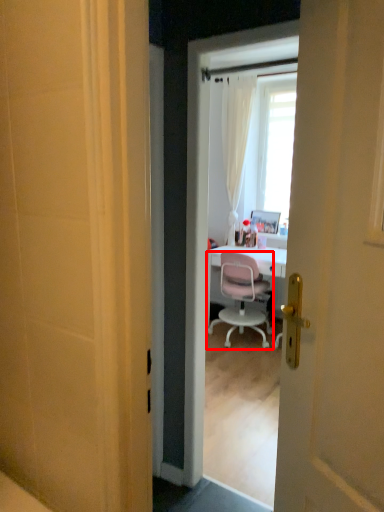
Question: From the image's perspective, where is chair (annotated by the red box) located relative to picture frame?

Choices:
 (A) below
 (B) above

Answer: (A)